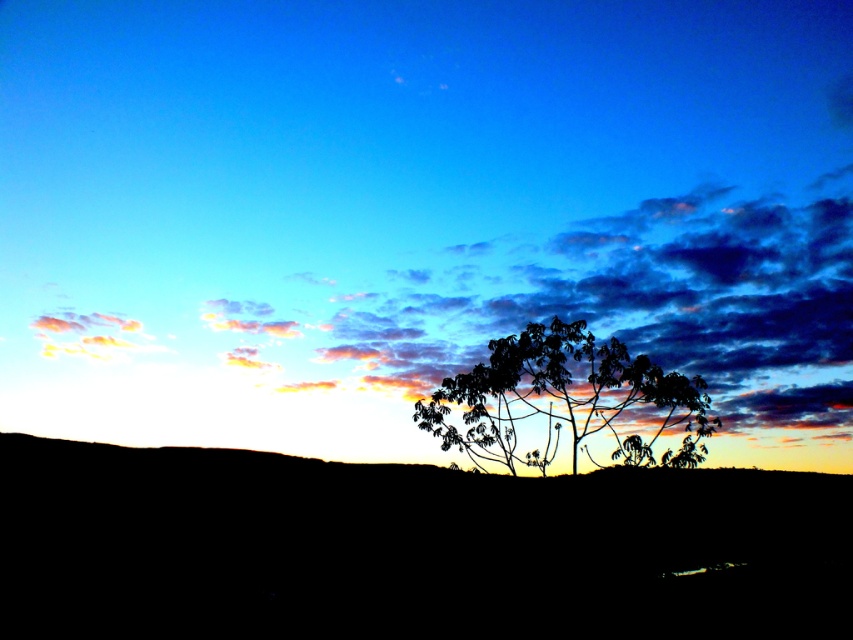
Question: Which point is farther from the camera taking this photo?

Choices:
 (A) (769, 440)
 (B) (532, 385)

Answer: (A)

Question: Considering the relative positions of cloudy sky at upper center and silhouette leafy tree at center in the image provided, where is cloudy sky at upper center located with respect to silhouette leafy tree at center?

Choices:
 (A) above
 (B) below

Answer: (A)

Question: Which point appears closest to the camera in this image?

Choices:
 (A) (624, 372)
 (B) (234, 442)

Answer: (A)

Question: Can you confirm if cloudy sky at upper center is bigger than silhouette leafy tree at center?

Choices:
 (A) no
 (B) yes

Answer: (B)

Question: Is cloudy sky at upper center positioned in front of silhouette leafy tree at center?

Choices:
 (A) no
 (B) yes

Answer: (B)